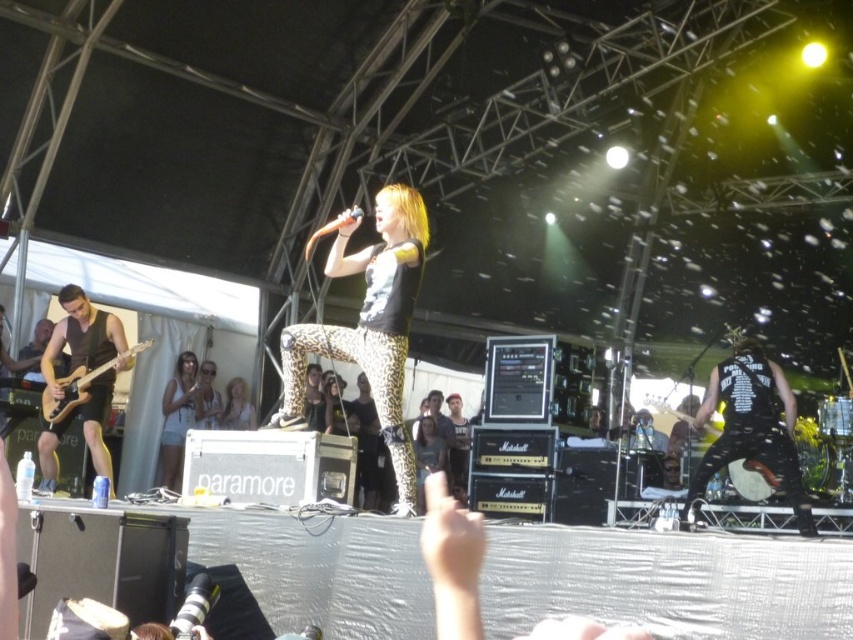
Question: Among these points, which one is farthest from the camera?

Choices:
 (A) (190, 387)
 (B) (236, 413)

Answer: (B)

Question: Is the position of white leopard print pants at center more distant than that of matte brown electric guitar at left?

Choices:
 (A) no
 (B) yes

Answer: (B)

Question: Can you confirm if sunglasses at center is positioned above wooden drum at right?

Choices:
 (A) no
 (B) yes

Answer: (B)

Question: Among these objects, which one is nearest to the camera?

Choices:
 (A) white leopard print pants at center
 (B) wooden drum at right
 (C) sunglasses at center

Answer: (A)

Question: Which of the following is the farthest from the observer?

Choices:
 (A) white leopard print pants at center
 (B) leopard print pants at center
 (C) sunglasses at center

Answer: (B)

Question: Does white leopard print pants at center come behind sunglasses at center?

Choices:
 (A) yes
 (B) no

Answer: (B)